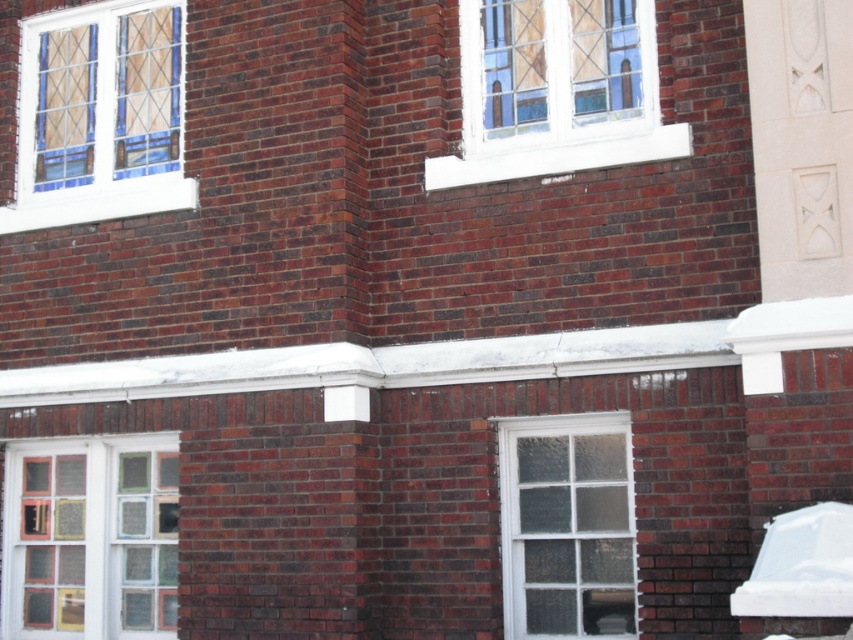
Image resolution: width=853 pixels, height=640 pixels. What do you see at coordinates (558, 93) in the screenshot?
I see `clear glass window at upper center` at bounding box center [558, 93].

In the scene shown: Who is more distant from viewer, (558, 90) or (556, 515)?

The point (558, 90) is behind.

Between point (636, 10) and point (593, 550), which one is positioned in front?

Point (593, 550) is in front.

Locate an element on the screen. The height and width of the screenshot is (640, 853). clear glass window at upper center is located at coordinates (558, 93).

Does multicolored glass window at lower left come behind clear glass window at center?

Yes.

Measure the distance between multicolored glass window at lower left and camera.

multicolored glass window at lower left and camera are 32.17 feet apart.

The image size is (853, 640). In order to click on multicolored glass window at lower left in this screenshot , I will do `click(90, 538)`.

Which is behind, point (163, 168) or point (558, 540)?

Positioned behind is point (163, 168).

Consider the image. Which is above, stained glass window at upper left or clear glass window at center?

stained glass window at upper left is above.

Image resolution: width=853 pixels, height=640 pixels. Find the location of `stained glass window at upper left`. stained glass window at upper left is located at coordinates (100, 115).

Image resolution: width=853 pixels, height=640 pixels. Find the location of `stained glass window at upper left`. stained glass window at upper left is located at coordinates (100, 115).